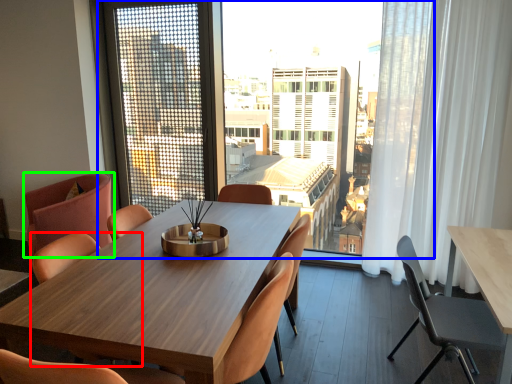
Question: Which is nearer to the chair (highlighted by a red box)? window (highlighted by a blue box) or chair (highlighted by a green box).

Choices:
 (A) window
 (B) chair

Answer: (B)